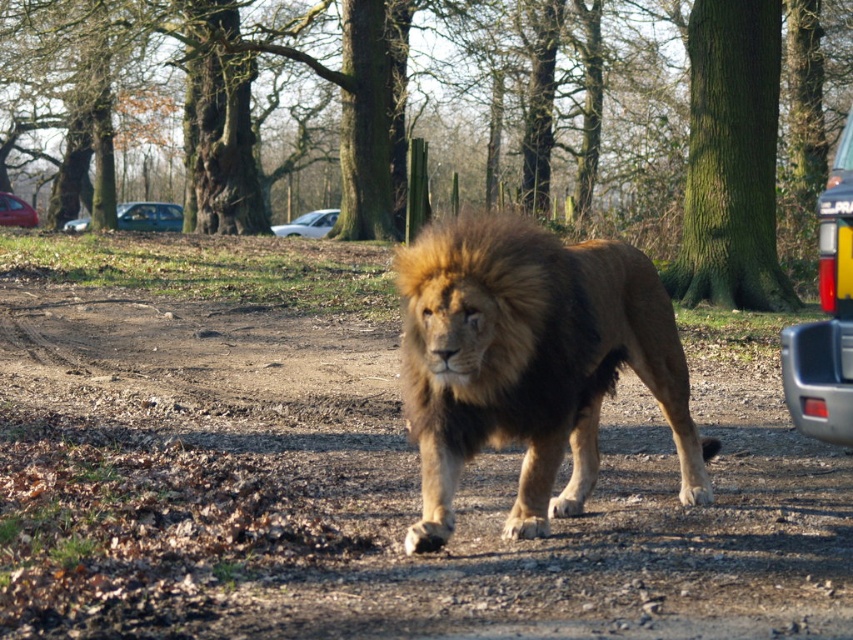
You are a zookeeper trying to decide if the brown furry lion at center can comfortably walk past the white matte car at center. Based on their sizes, can the lion easily move around the car without difficulty?

The brown furry lion at center is smaller than the white matte car at center, so it can easily move around the car without any difficulty.

Consider the image. You are a zookeeper who needs to transport the brown furry lion at center and the metallic blue sedan at left to a new location. Which object requires more space for transportation?

The metallic blue sedan at left requires more space for transportation because the brown furry lion at center occupies less space than it.